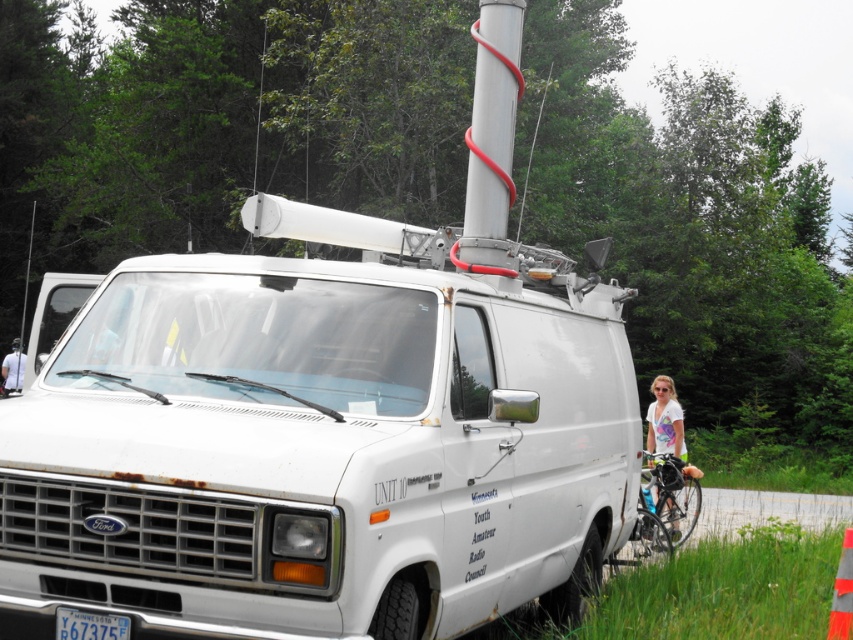
Question: Does yellow matte license plate at lower center have a larger size compared to orange fabric cone at center?

Choices:
 (A) no
 (B) yes

Answer: (A)

Question: Considering the real-world distances, which object is farthest from the shiny black bicycle at right?

Choices:
 (A) orange fabric cone at center
 (B) white cotton shirt at right
 (C) white fabric shirt at left
 (D) white matte van at center

Answer: (C)

Question: Considering the real-world distances, which object is farthest from the shiny black bicycle at right?

Choices:
 (A) orange fabric cone at center
 (B) white matte van at center

Answer: (A)

Question: Does orange fabric cone at center appear over white fabric shirt at left?

Choices:
 (A) yes
 (B) no

Answer: (B)

Question: Can you confirm if white matte van at center is bigger than orange fabric cone at center?

Choices:
 (A) yes
 (B) no

Answer: (A)

Question: Among these points, which one is farthest from the camera?

Choices:
 (A) (509, 401)
 (B) (842, 545)
 (C) (106, 637)

Answer: (B)